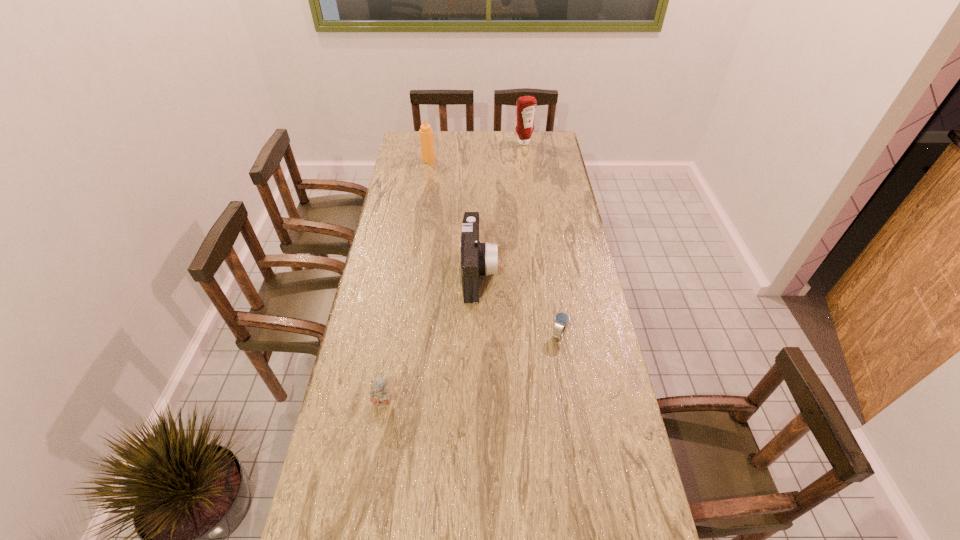
This screenshot has width=960, height=540. I want to click on free point between the third object from left to right and the fourth farthest object, so click(519, 303).

Locate an element on the screen. vacant area that lies between the nearer condiment and the teddy bear is located at coordinates (406, 281).

Locate an element on the screen. This screenshot has width=960, height=540. unoccupied area between the third tallest object and the right condiment is located at coordinates (501, 208).

I want to click on free spot between the second nearest object and the fourth tallest object, so click(x=471, y=368).

Identify the location of vacant space that is in between the right condiment and the left condiment. (476, 151).

Locate an element on the screen. the fourth closest object to the third tallest object is located at coordinates (526, 106).

Identify which object is located as the fourth nearest to the left condiment. Please provide its 2D coordinates. Your answer should be formatted as a tuple, i.e. [(x, y)], where the tuple contains the x and y coordinates of a point satisfying the conditions above.

[(380, 397)]